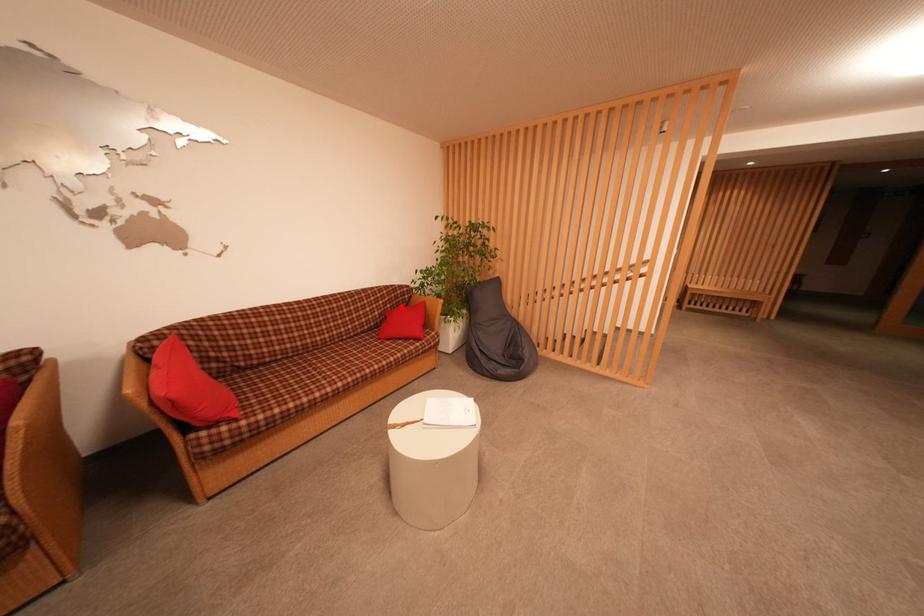
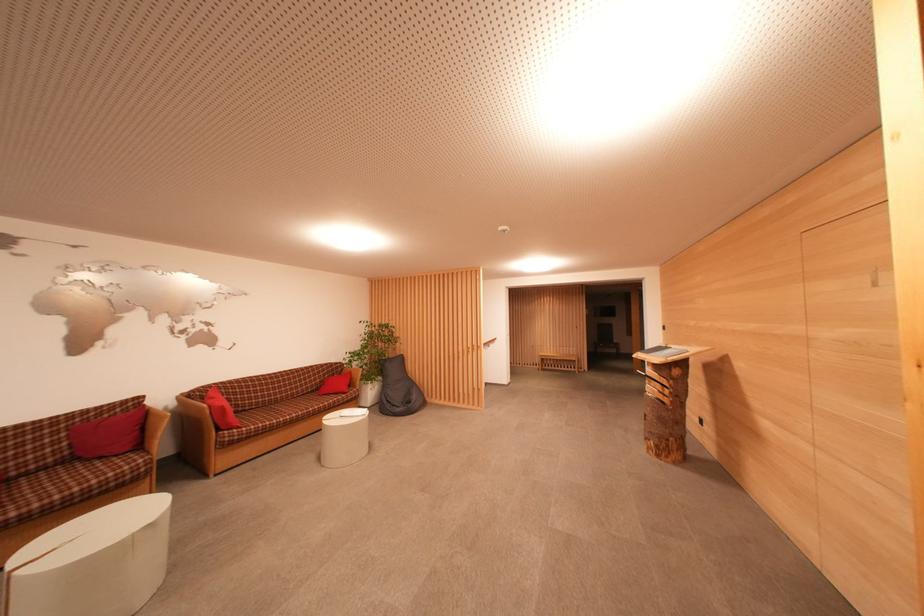
Find the pixel in the second image that matches the highlighted location in the first image.

(337, 378)